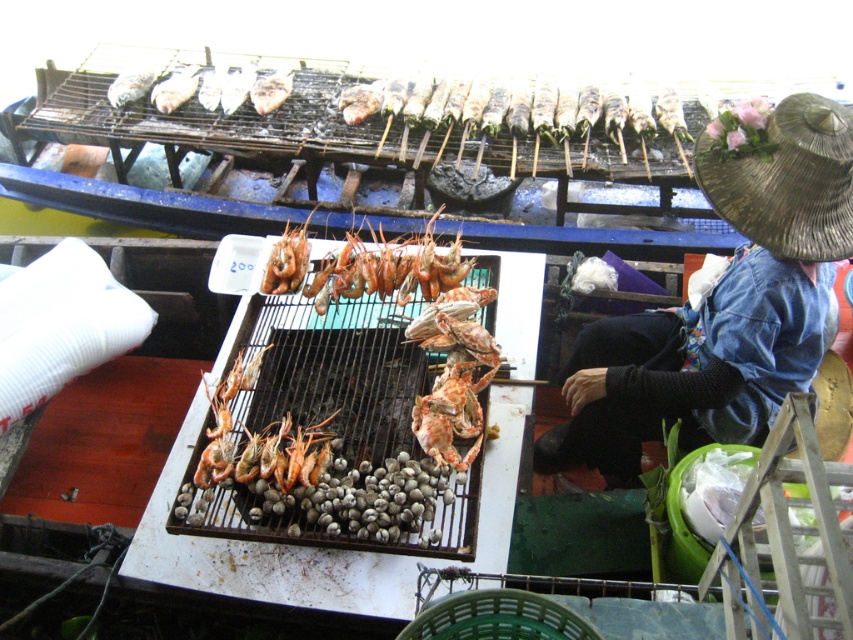
Question: Does brown woven straw hat at upper right have a lesser width compared to shiny orange shrimp at center?

Choices:
 (A) no
 (B) yes

Answer: (A)

Question: Is brown woven straw hat at upper right thinner than shiny orange shrimp at center?

Choices:
 (A) no
 (B) yes

Answer: (A)

Question: Is brown woven straw hat at upper right further to camera compared to shiny orange shrimp at center?

Choices:
 (A) yes
 (B) no

Answer: (B)

Question: Which point is farther from the camera taking this photo?

Choices:
 (A) (715, 204)
 (B) (418, 419)

Answer: (B)